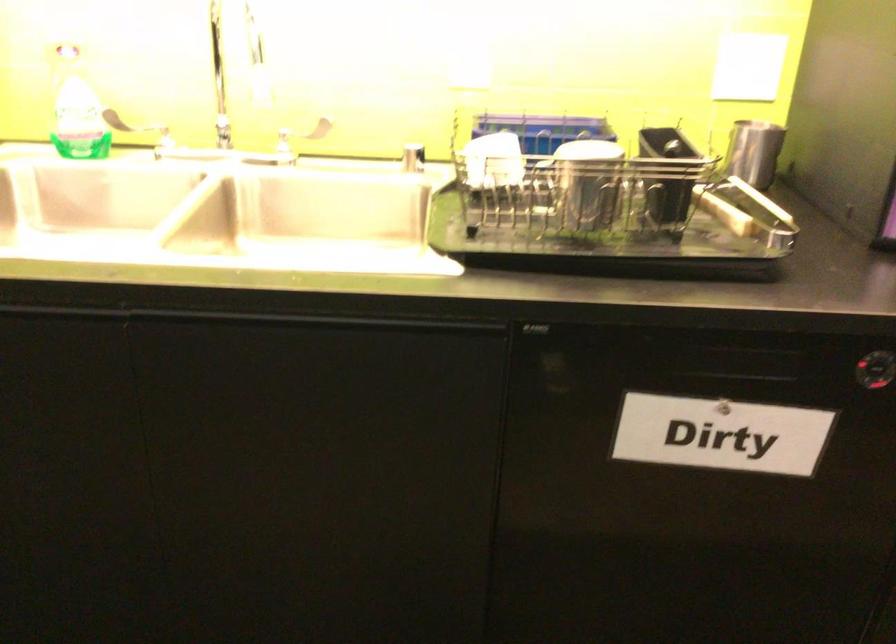
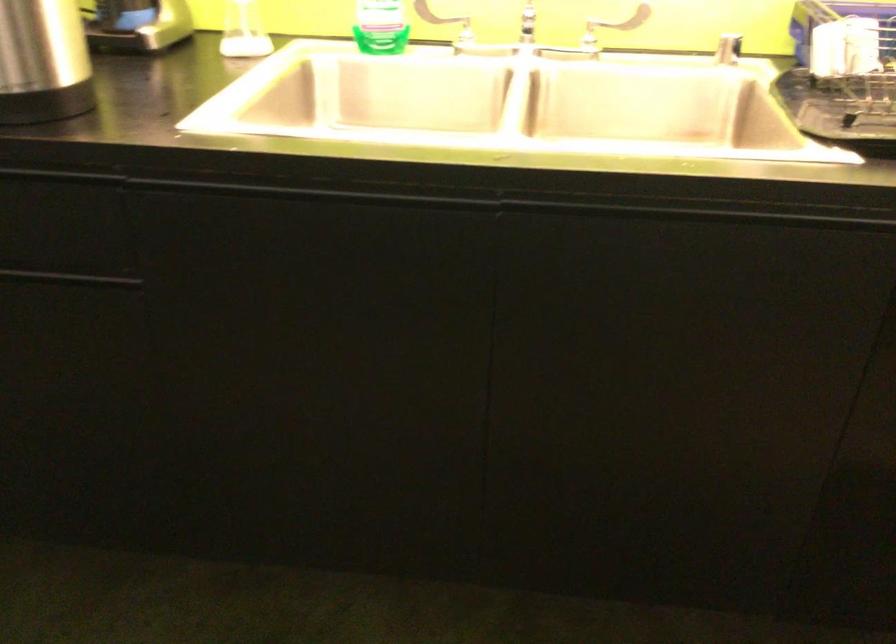
Locate, in the second image, the point that corresponds to (82,131) in the first image.

(381, 26)